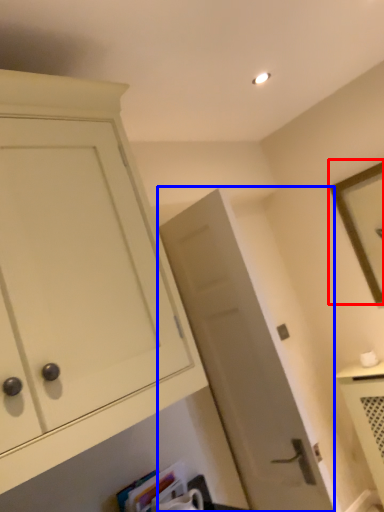
Question: Which point is closer to the camera, picture frame (highlighted by a red box) or door (highlighted by a blue box)?

Choices:
 (A) picture frame
 (B) door

Answer: (B)